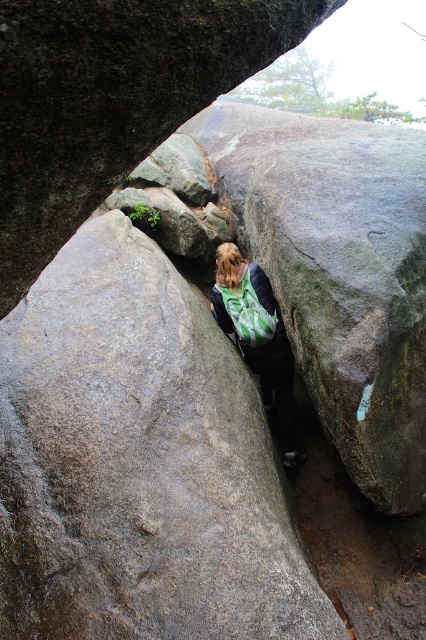
Between gray rough boulder at center and green fabric backpack at center, which one appears on the left side from the viewer's perspective?

From the viewer's perspective, gray rough boulder at center appears more on the left side.

Does point (28, 193) come farther from viewer compared to point (230, 259)?

That is False.

The width and height of the screenshot is (426, 640). Find the location of `gray rough boulder at center`. gray rough boulder at center is located at coordinates (112, 99).

Identify the location of gray rough boulder at center. (112, 99).